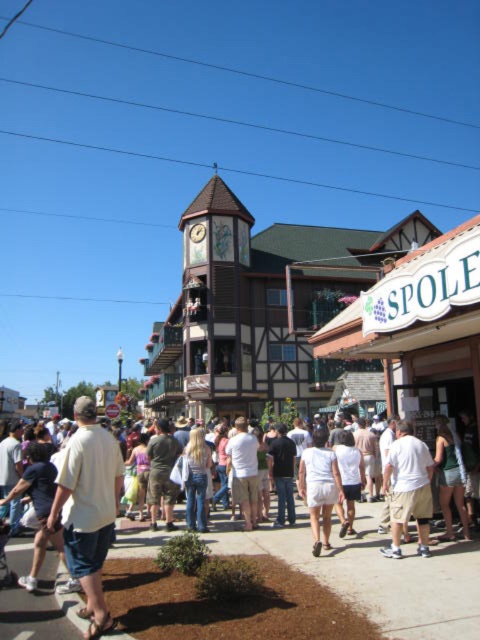
You are a photographer standing in the town square and want to take a photo of the light beige shirt at center without the brown wooden clock tower at center blocking it. How should you position yourself?

The light beige shirt at center is behind the brown wooden clock tower at center, so to avoid the tower blocking the shirt, you should move to a position where the tower is no longer between you and the shirt. This could involve moving to the side or adjusting your angle to capture the shirt without the tower obstructing the view.

You are standing in the town square and want to reach the point marked as point (190,248). If your walking speed is 1.2 meters per second, how many seconds will it take you to reach that point?

The distance between you and point (190,248) is 110.53 meters. At a walking speed of 1.2 meters per second, it will take approximately 92.11 seconds to reach the point.